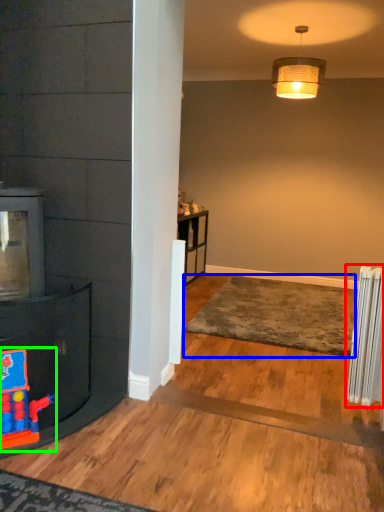
Question: Which object is positioned farthest from radiator (highlighted by a red box)? Select from plain (highlighted by a blue box) and toy (highlighted by a green box).

Choices:
 (A) plain
 (B) toy

Answer: (B)